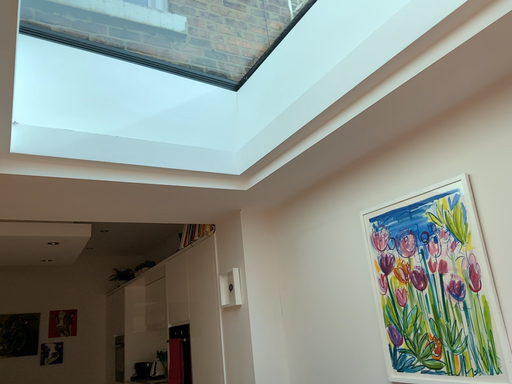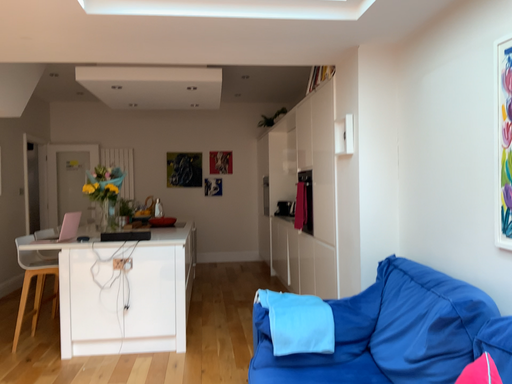
Question: How did the camera likely rotate when shooting the video?

Choices:
 (A) rotated left
 (B) rotated right

Answer: (A)